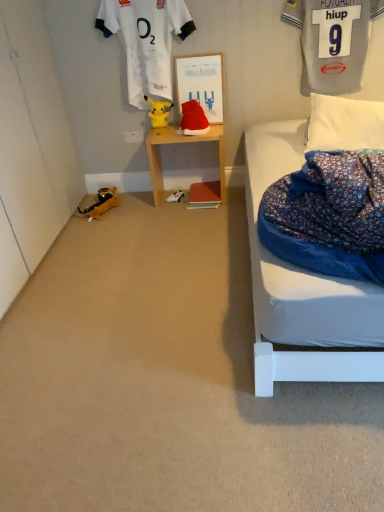
Find the location of a particular element. The height and width of the screenshot is (512, 384). free space to the left of velvet red santa hat at center, acting as the 1th toy starting from the right is located at coordinates tap(173, 131).